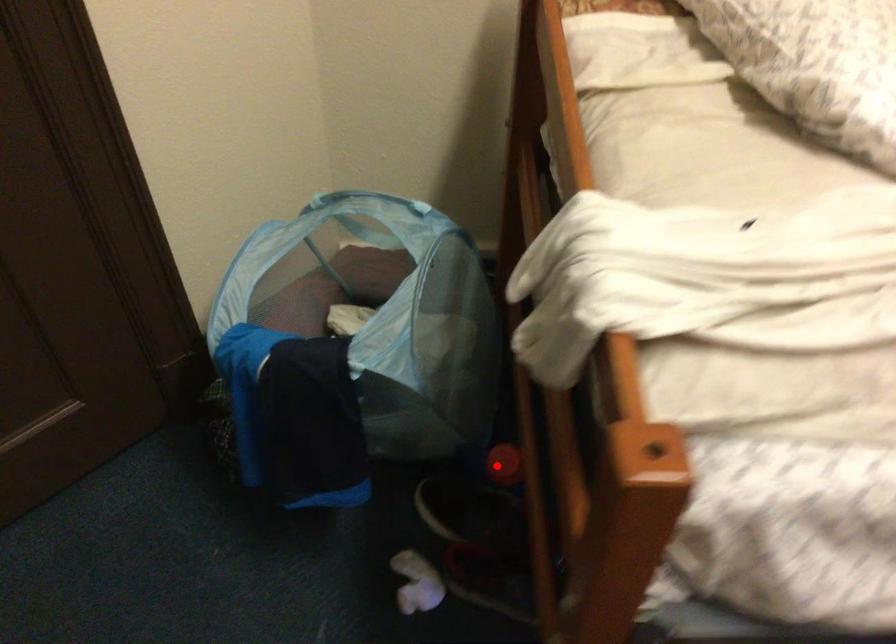
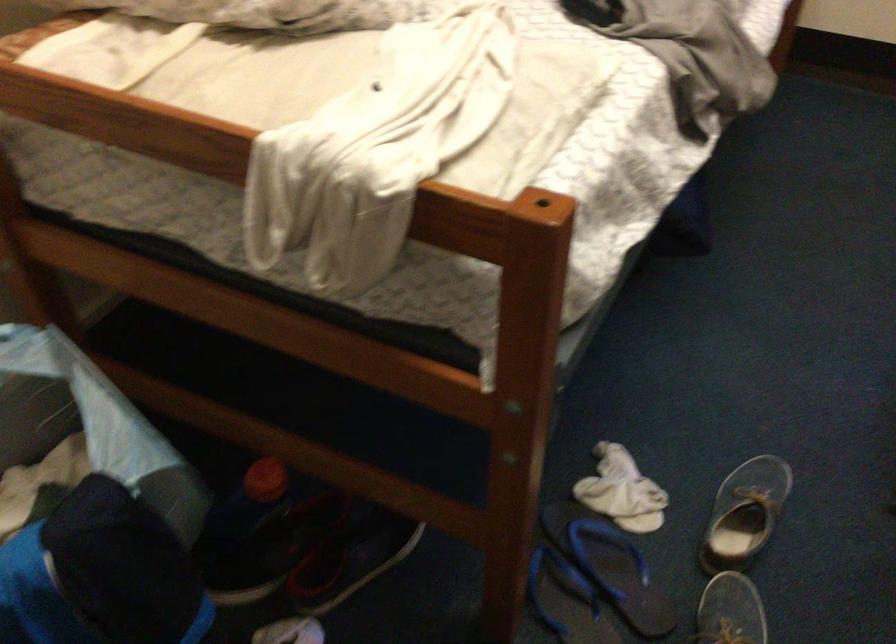
Where in the second image is the point corresponding to the highlighted location from the first image?

(264, 480)